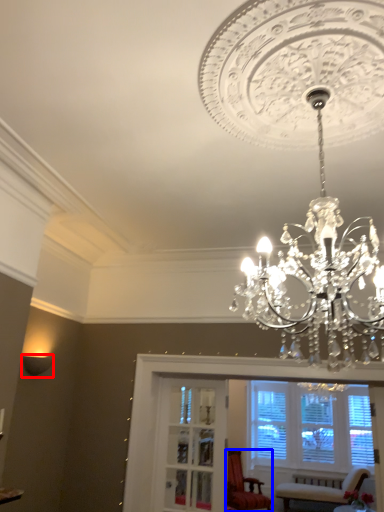
Question: Which object is further to the camera taking this photo, lamp (highlighted by a red box) or chair (highlighted by a blue box)?

Choices:
 (A) lamp
 (B) chair

Answer: (B)